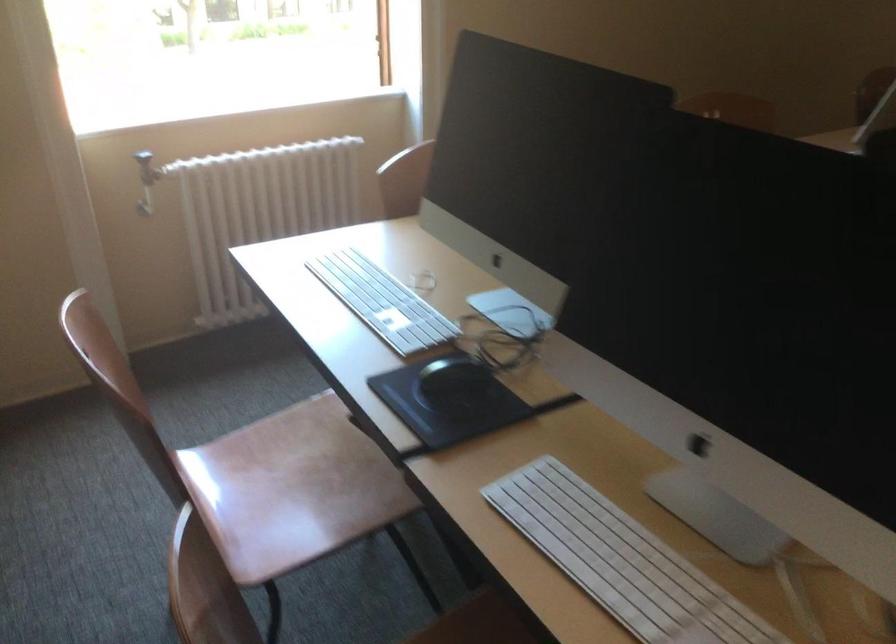
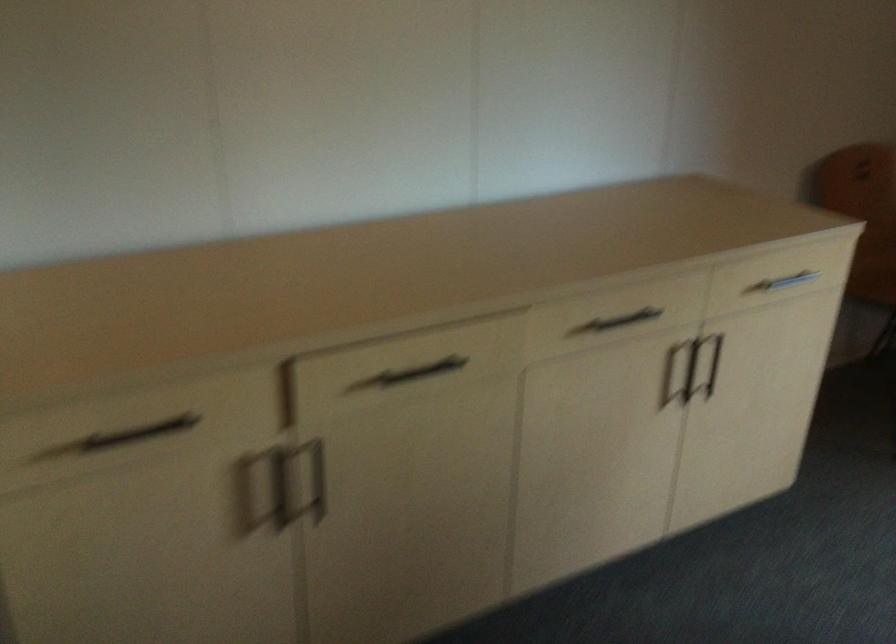
The images are taken continuously from a first-person perspective. In which direction is your viewpoint rotating?

The rotation direction of the camera is left-down.